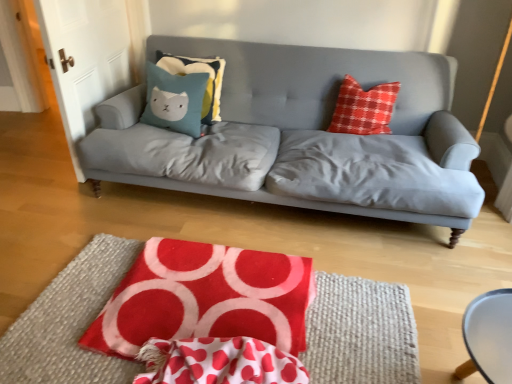
Locate an element on the screen. The height and width of the screenshot is (384, 512). free spot behind red felt rug at center is located at coordinates (208, 217).